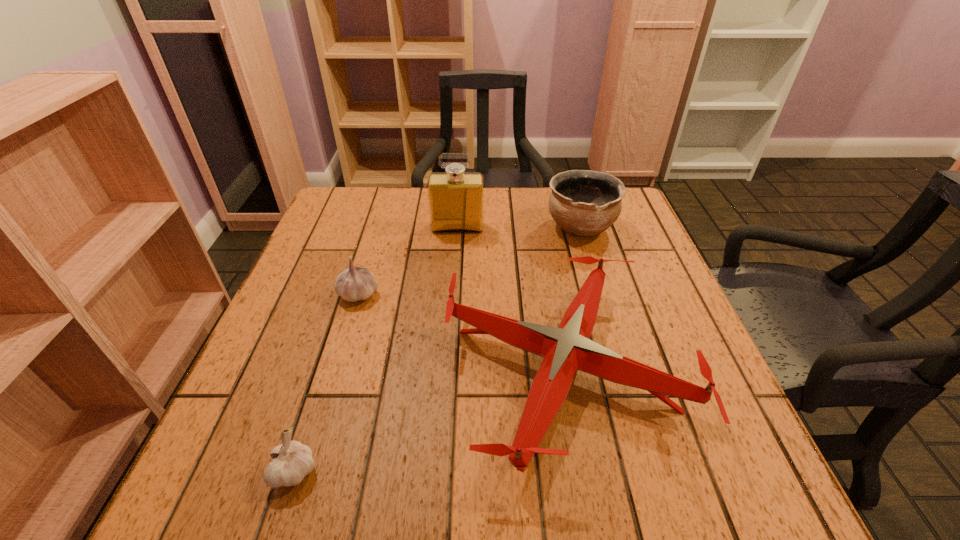
At what (x,y) coordinates should I click in order to perform the action: click on perfume located at the far edge. Please return your answer as a coordinate pair (x, y). This screenshot has height=540, width=960. Looking at the image, I should click on (456, 198).

This screenshot has width=960, height=540. I want to click on pottery at the far edge, so click(x=582, y=202).

Identify the location of drone at the near edge. This screenshot has height=540, width=960. (565, 350).

Find the location of a particular element. garlic present at the near edge is located at coordinates (291, 461).

At what (x,y) coordinates should I click in order to perform the action: click on pottery located at the right edge. Please return your answer as a coordinate pair (x, y). Image resolution: width=960 pixels, height=540 pixels. Looking at the image, I should click on (582, 202).

I want to click on drone that is at the right edge, so click(x=565, y=350).

The width and height of the screenshot is (960, 540). Identify the location of object that is positioned at the near left corner. (291, 461).

The image size is (960, 540). In order to click on object that is at the far right corner in this screenshot , I will do `click(582, 202)`.

Where is `object positioned at the near right corner`? The height and width of the screenshot is (540, 960). object positioned at the near right corner is located at coordinates (565, 350).

In the image, there is a desktop. Identify the location of vacant space at the far edge. This screenshot has width=960, height=540. (385, 217).